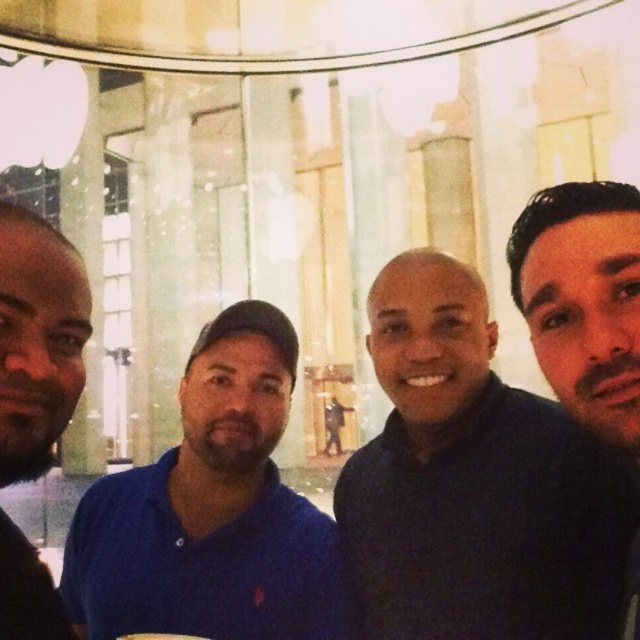
Question: From the image, what is the correct spatial relationship of dark blue sweater at center in relation to blue cotton polo shirt at center?

Choices:
 (A) right
 (B) left

Answer: (A)

Question: Does dark blue sweater at center have a larger size compared to blue cotton polo shirt at center?

Choices:
 (A) yes
 (B) no

Answer: (A)

Question: Which object is closer to the camera taking this photo?

Choices:
 (A) dark brown hair at upper right
 (B) dark blue shirt at left
 (C) dark blue sweater at center

Answer: (A)

Question: Among these points, which one is nearest to the camera?

Choices:
 (A) (4, 636)
 (B) (605, 589)

Answer: (A)

Question: Which object is positioned farthest from the dark blue shirt at left?

Choices:
 (A) dark blue sweater at center
 (B) dark brown hair at upper right

Answer: (A)

Question: Does dark blue sweater at center appear on the left side of blue cotton polo shirt at center?

Choices:
 (A) yes
 (B) no

Answer: (B)